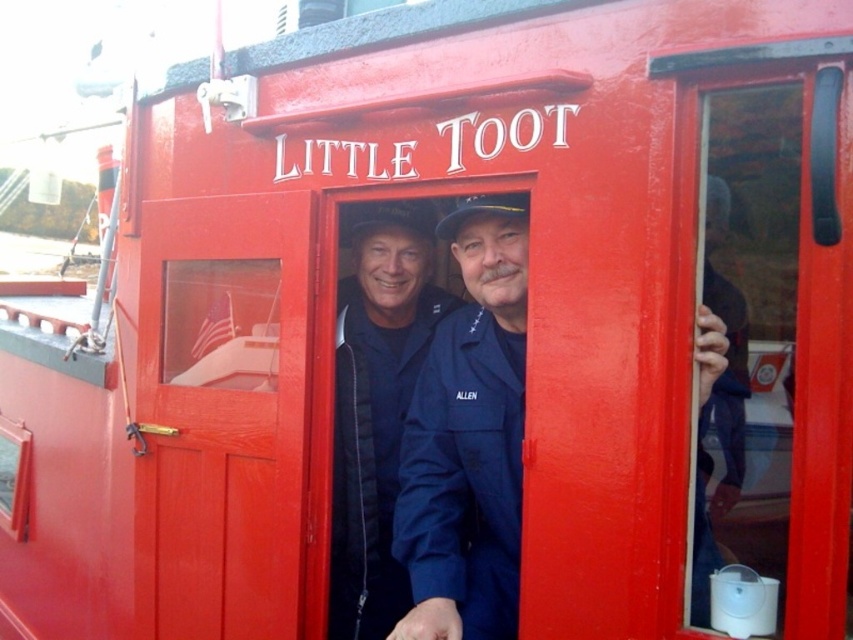
Is blue fabric uniform at center below blue denim jacket at right?

Yes, blue fabric uniform at center is below blue denim jacket at right.

Between blue fabric uniform at center and blue denim jacket at right, which one is positioned higher?

Positioned higher is blue denim jacket at right.

Does point (514, 605) come in front of point (727, 452)?

No, it is behind (727, 452).

Find the location of a particular element. The image size is (853, 640). blue fabric uniform at center is located at coordinates (468, 438).

Looking at this image, can you confirm if blue fabric uniform at center is positioned to the left of blue fabric jacket at center?

Incorrect, blue fabric uniform at center is not on the left side of blue fabric jacket at center.

Which of these two, blue fabric uniform at center or blue fabric jacket at center, stands shorter?

blue fabric uniform at center

Locate an element on the screen. This screenshot has width=853, height=640. blue fabric uniform at center is located at coordinates (468, 438).

Does point (375, 492) come in front of point (711, 516)?

No, (375, 492) is further to viewer.

Does point (419, 328) come behind point (723, 420)?

Yes, it is.

You are a GUI agent. You are given a task and a screenshot of the screen. Output one action in this format:
    pyautogui.click(x=<x>, y=<y>)
    Task: Click on the blue fabric jacket at center
    The height and width of the screenshot is (640, 853).
    Given the screenshot: What is the action you would take?
    pyautogui.click(x=376, y=408)

Locate an element on the screen. This screenshot has width=853, height=640. blue fabric jacket at center is located at coordinates (376, 408).